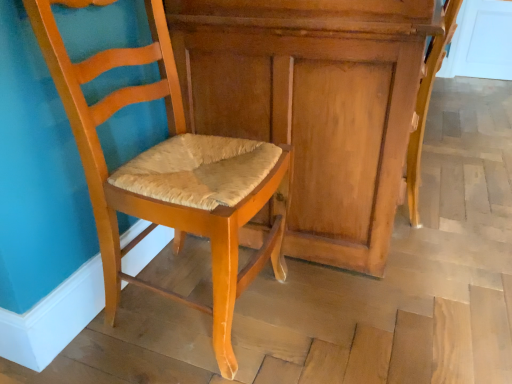
Question: From a real-world perspective, is matte wood chair at center, placed as the 1th chair when sorted from left to right, physically above wooden dresser at center?

Choices:
 (A) no
 (B) yes

Answer: (B)

Question: Does matte wood chair at center, placed as the 1th chair when sorted from left to right, have a larger size compared to wooden dresser at center?

Choices:
 (A) no
 (B) yes

Answer: (A)

Question: Is wooden dresser at center at the back of matte wood chair at center, placed as the 1th chair when sorted from left to right?

Choices:
 (A) no
 (B) yes

Answer: (A)

Question: Does matte wood chair at center, placed as the 1th chair when sorted from left to right, have a lesser width compared to wooden dresser at center?

Choices:
 (A) yes
 (B) no

Answer: (A)

Question: From the image's perspective, is matte wood chair at center, the second chair viewed from the right, over wooden dresser at center?

Choices:
 (A) yes
 (B) no

Answer: (B)

Question: In terms of height, does matte wood chair at center, the second chair viewed from the right, look taller or shorter compared to light brown wood chair at lower right, arranged as the first chair when viewed from the right?

Choices:
 (A) tall
 (B) short

Answer: (A)

Question: From a real-world perspective, is matte wood chair at center, placed as the 1th chair when sorted from left to right, physically located above or below light brown wood chair at lower right, which is the second chair in left-to-right order?

Choices:
 (A) below
 (B) above

Answer: (B)

Question: Relative to light brown wood chair at lower right, which is the second chair in left-to-right order, is matte wood chair at center, the second chair viewed from the right, in front or behind?

Choices:
 (A) behind
 (B) front

Answer: (B)

Question: In terms of size, does matte wood chair at center, the second chair viewed from the right, appear bigger or smaller than light brown wood chair at lower right, arranged as the first chair when viewed from the right?

Choices:
 (A) small
 (B) big

Answer: (B)

Question: Would you say matte wood chair at center, the second chair viewed from the right, is to the left or to the right of wooden dresser at center in the picture?

Choices:
 (A) left
 (B) right

Answer: (A)

Question: Relative to wooden dresser at center, is matte wood chair at center, the second chair viewed from the right, in front or behind?

Choices:
 (A) behind
 (B) front

Answer: (B)

Question: In terms of width, does matte wood chair at center, placed as the 1th chair when sorted from left to right, look wider or thinner when compared to wooden dresser at center?

Choices:
 (A) wide
 (B) thin

Answer: (B)

Question: In terms of size, does matte wood chair at center, placed as the 1th chair when sorted from left to right, appear bigger or smaller than wooden dresser at center?

Choices:
 (A) big
 (B) small

Answer: (B)

Question: In terms of width, does light brown wood chair at lower right, which is the second chair in left-to-right order, look wider or thinner when compared to matte wood chair at center, the second chair viewed from the right?

Choices:
 (A) wide
 (B) thin

Answer: (B)

Question: From a real-world perspective, relative to matte wood chair at center, the second chair viewed from the right, is light brown wood chair at lower right, arranged as the first chair when viewed from the right, vertically above or below?

Choices:
 (A) below
 (B) above

Answer: (A)